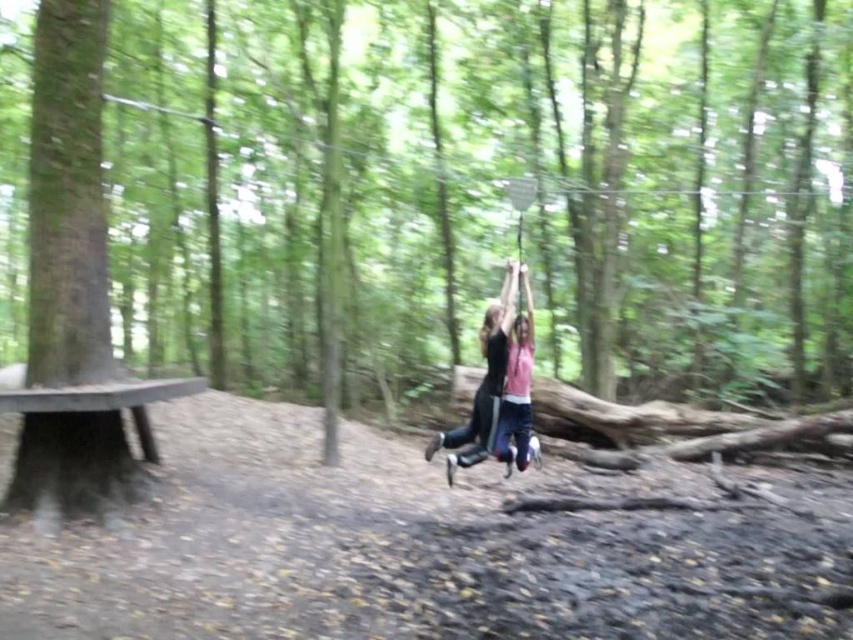
Does point (468, 442) come in front of point (511, 346)?

No, (468, 442) is behind (511, 346).

Which of these two, black fabric swing at center or pink matte shirt at center, stands shorter?

Standing shorter between the two is pink matte shirt at center.

Which is behind, point (448, 435) or point (519, 314)?

The point (448, 435) is more distant.

You are a GUI agent. You are given a task and a screenshot of the screen. Output one action in this format:
    pyautogui.click(x=<x>, y=<y>)
    Task: Click on the black fabric swing at center
    The image size is (853, 640).
    Given the screenshot: What is the action you would take?
    pyautogui.click(x=483, y=385)

Is dark brown wooden picnic table at lower left to the left of pink matte shirt at center from the viewer's perspective?

Yes, dark brown wooden picnic table at lower left is to the left of pink matte shirt at center.

Who is positioned more to the left, dark brown wooden picnic table at lower left or pink matte shirt at center?

From the viewer's perspective, dark brown wooden picnic table at lower left appears more on the left side.

Locate an element on the screen. dark brown wooden picnic table at lower left is located at coordinates point(82,442).

Is point (57, 433) farther from viewer compared to point (479, 435)?

No, (57, 433) is in front of (479, 435).

Who is higher up, dark brown wooden picnic table at lower left or black fabric swing at center?

black fabric swing at center

Is point (138, 381) less distant than point (489, 317)?

That is True.

Find the location of a particular element. The height and width of the screenshot is (640, 853). dark brown wooden picnic table at lower left is located at coordinates (82, 442).